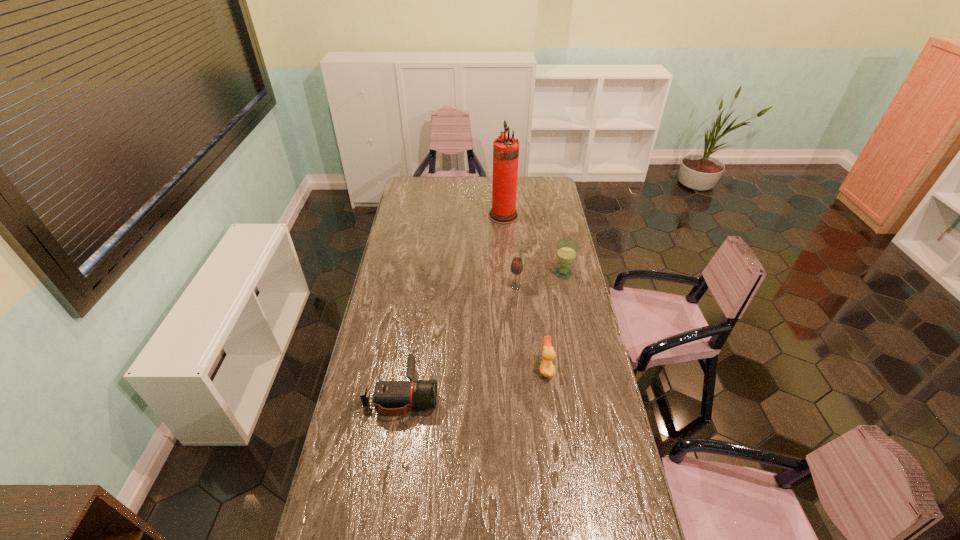
Identify the location of vacant region at the left edge of the desktop. The image size is (960, 540). (382, 377).

Locate an element on the screen. Image resolution: width=960 pixels, height=540 pixels. vacant region at the right edge of the desktop is located at coordinates (585, 348).

Locate an element on the screen. This screenshot has height=540, width=960. vacant region at the far left corner of the desktop is located at coordinates (412, 179).

Where is `vacant space at the far right corner of the desktop`? The width and height of the screenshot is (960, 540). vacant space at the far right corner of the desktop is located at coordinates (543, 180).

Where is `free spot between the third farthest object and the fourth object from left to right`? The width and height of the screenshot is (960, 540). free spot between the third farthest object and the fourth object from left to right is located at coordinates (531, 327).

Identify the location of free space between the tallest object and the left glass drink container. This screenshot has width=960, height=540. (510, 251).

This screenshot has width=960, height=540. What are the coordinates of `unoccupied area between the duck and the left glass drink container` in the screenshot? It's located at (531, 327).

This screenshot has width=960, height=540. What are the coordinates of `vacant area that lies between the farther glass drink container and the farthest object` in the screenshot? It's located at (534, 244).

Where is `vacant area that lies between the duck and the farther glass drink container`? This screenshot has width=960, height=540. vacant area that lies between the duck and the farther glass drink container is located at coordinates (555, 321).

The image size is (960, 540). In order to click on vacant area that lies between the fire extinguisher and the camcorder in this screenshot , I will do tap(453, 304).